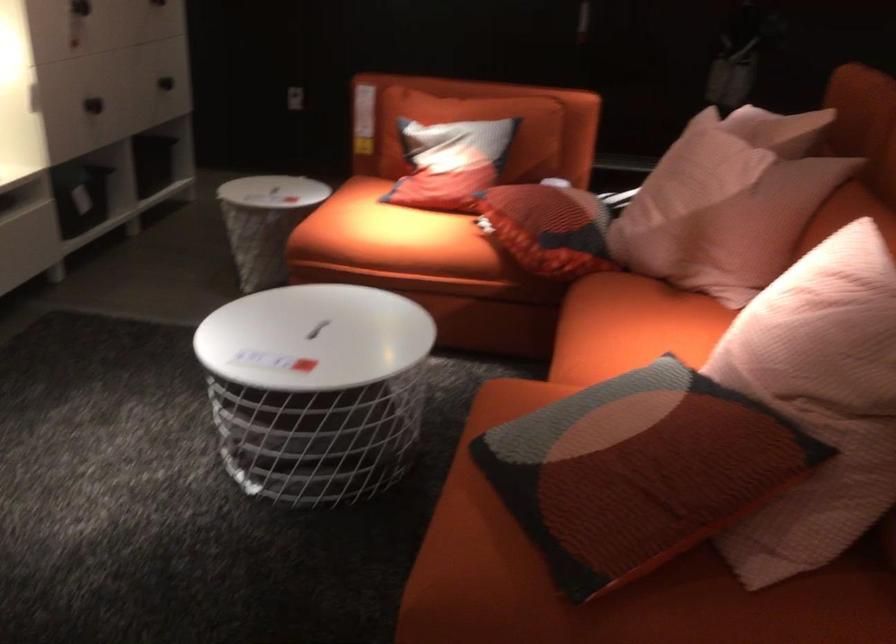
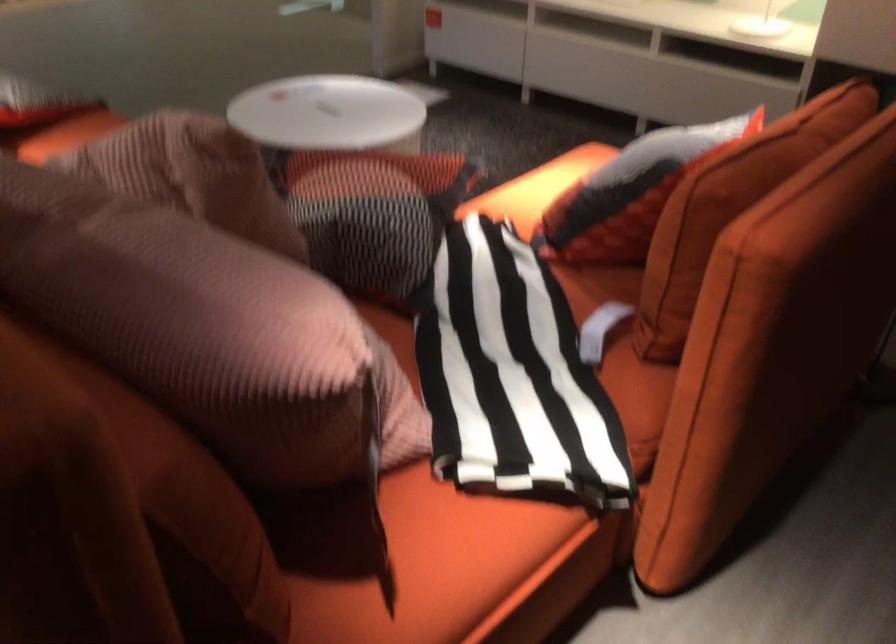
Locate, in the second image, the point that corresponds to (x=610, y=199) in the first image.

(512, 375)